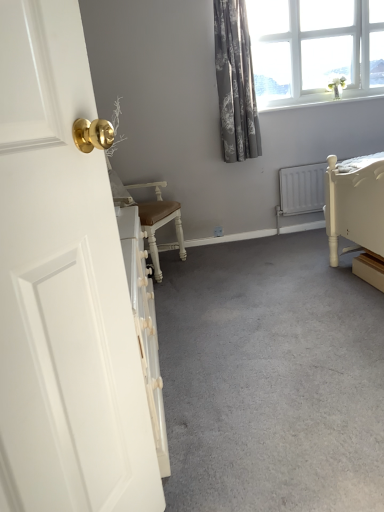
This screenshot has width=384, height=512. I want to click on vacant region below gray floral fabric curtain at upper right (from a real-world perspective), so [251, 238].